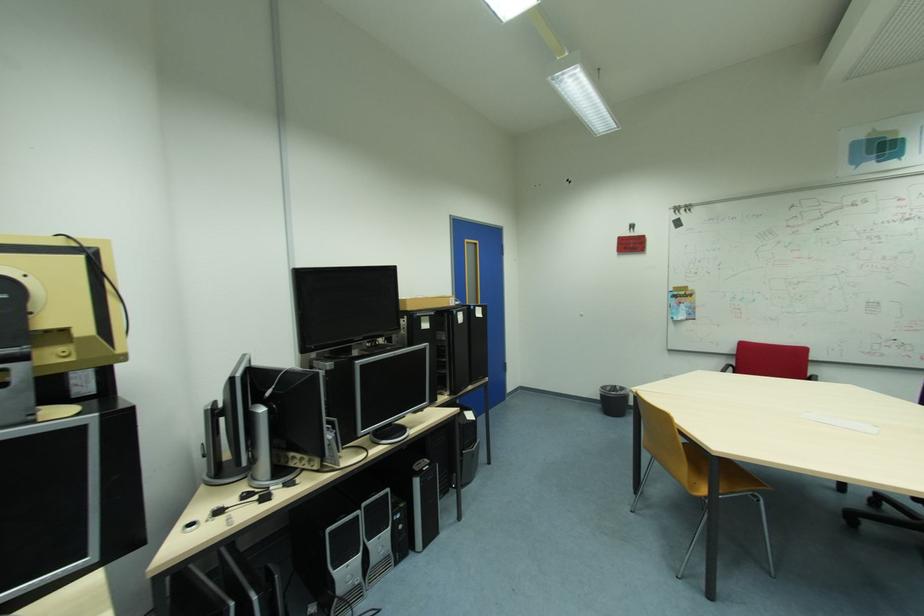
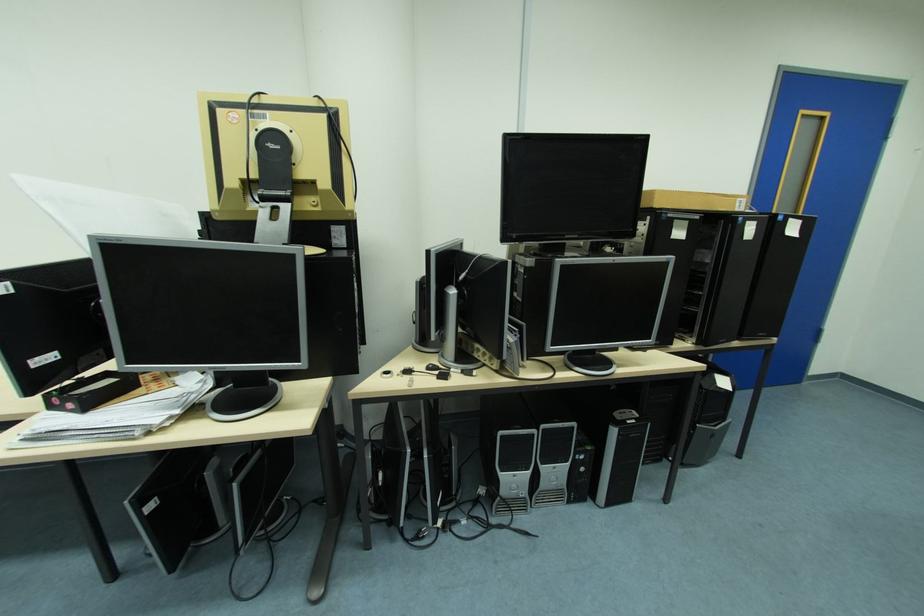
Find the pixel in the second image that matches (x=408, y=527) in the first image.

(590, 469)